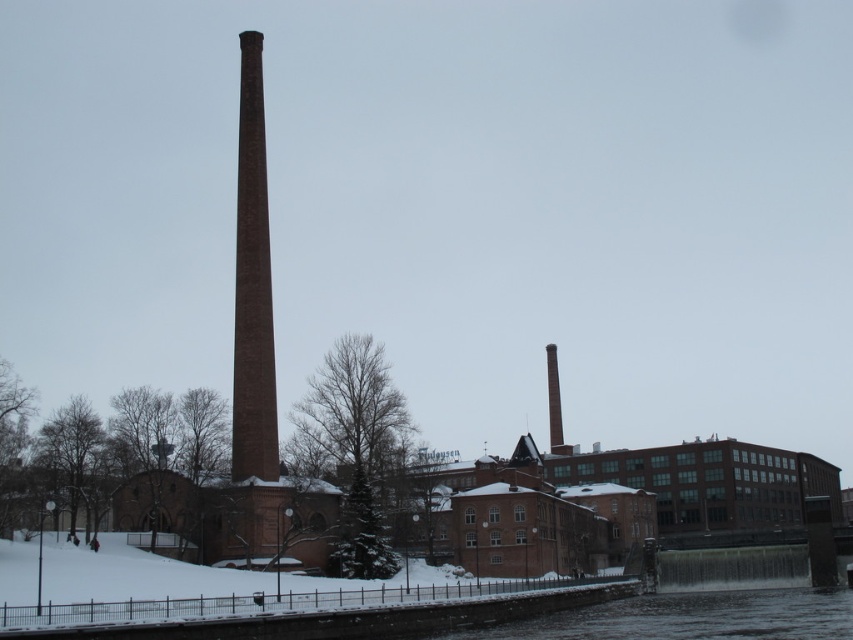
Question: Considering the relative positions of brown brick chimney at center and smooth brick chimney at center in the image provided, where is brown brick chimney at center located with respect to smooth brick chimney at center?

Choices:
 (A) above
 (B) below

Answer: (A)

Question: Among these objects, which one is farthest from the camera?

Choices:
 (A) smooth brick chimney at center
 (B) brown brick chimney at center

Answer: (A)

Question: Which point is farther from the camera taking this photo?

Choices:
 (A) (552, 355)
 (B) (247, 58)

Answer: (A)

Question: Where is brown brick chimney at center located in relation to smooth brick chimney at center in the image?

Choices:
 (A) below
 (B) above

Answer: (B)

Question: Can you confirm if brown brick chimney at center is positioned below smooth brick chimney at center?

Choices:
 (A) yes
 (B) no

Answer: (B)